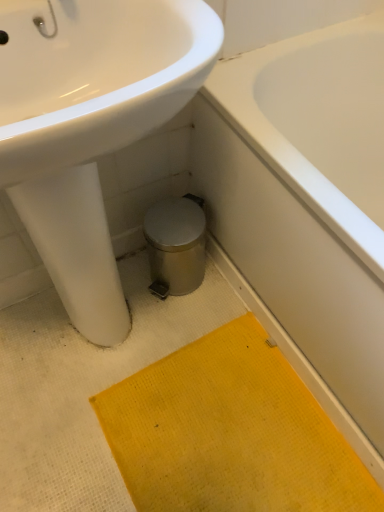
Question: Based on their positions, is white glossy sink at upper left located to the left or right of yellow textured bath mat at lower center?

Choices:
 (A) left
 (B) right

Answer: (A)

Question: Considering their positions, is white glossy sink at upper left located in front of or behind yellow textured bath mat at lower center?

Choices:
 (A) behind
 (B) front

Answer: (B)

Question: Which object is the closest to the white glossy sink at upper left?

Choices:
 (A) white glossy bathtub at lower right
 (B) yellow textured bath mat at lower center

Answer: (A)

Question: Based on their relative distances, which object is nearer to the yellow textured bath mat at lower center?

Choices:
 (A) white glossy bathtub at lower right
 (B) white glossy sink at upper left

Answer: (A)